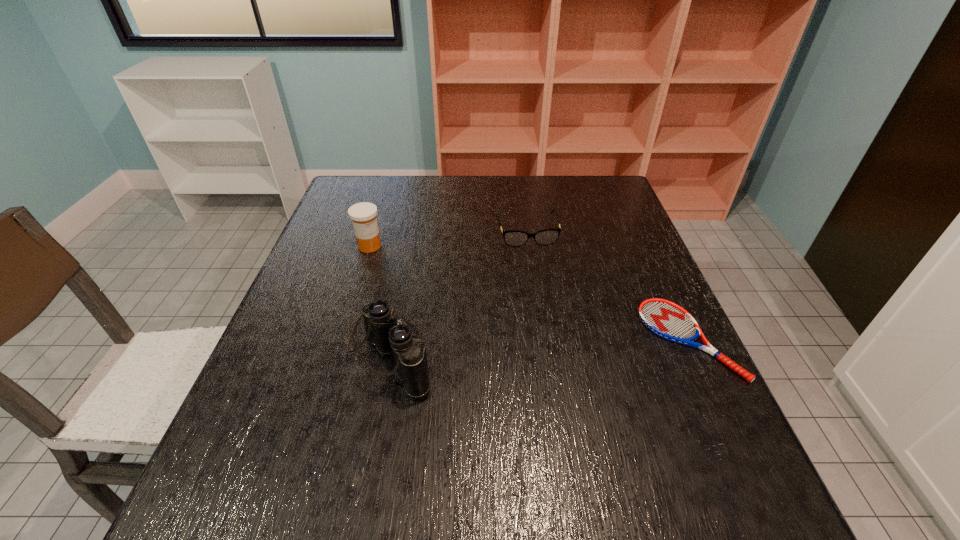
I want to click on binoculars, so tap(384, 331).

I want to click on tennis racket, so click(668, 320).

The height and width of the screenshot is (540, 960). What are the coordinates of `the shortest object` in the screenshot? It's located at (668, 320).

Where is `medicine`? The height and width of the screenshot is (540, 960). medicine is located at coordinates (363, 215).

Locate an element on the screen. This screenshot has width=960, height=540. spectacles is located at coordinates (514, 238).

Find the location of a particular element. Image resolution: width=960 pixels, height=540 pixels. the third tallest object is located at coordinates (514, 238).

This screenshot has height=540, width=960. I want to click on free location located 0.290m on the right of the binoculars, so click(571, 352).

Find the location of a particular element. This screenshot has width=960, height=540. free spot located on the left of the tennis racket is located at coordinates (591, 340).

You are a GUI agent. You are given a task and a screenshot of the screen. Output one action in this format:
    pyautogui.click(x=<x>, y=<y>)
    Task: Click on the free space located 0.390m on the label of the third shortest object
    The height and width of the screenshot is (540, 960).
    Given the screenshot: What is the action you would take?
    pyautogui.click(x=500, y=307)

Identify the location of vacant area situated 0.230m on the label of the third shortest object. The image size is (960, 540). (446, 282).